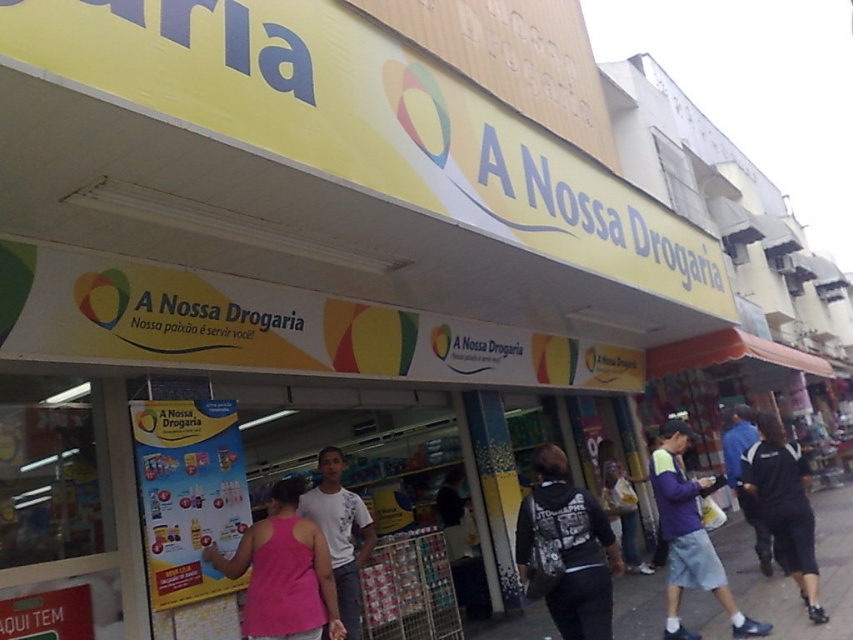
Does smooth concrete pavement at lower center lie in front of black cotton shirt at lower right?

No, smooth concrete pavement at lower center is further to the viewer.

Who is more distant from viewer, (x=787, y=616) or (x=795, y=557)?

The point (x=795, y=557) is behind.

The height and width of the screenshot is (640, 853). Describe the element at coordinates (790, 579) in the screenshot. I see `smooth concrete pavement at lower center` at that location.

Locate an element on the screen. Image resolution: width=853 pixels, height=640 pixels. smooth concrete pavement at lower center is located at coordinates (790, 579).

Locate an element on the screen. purple cotton hoodie at center is located at coordinates (689, 536).

Which is more to the left, purple cotton hoodie at center or dark blue jacket at center?

purple cotton hoodie at center is more to the left.

The image size is (853, 640). Identify the location of purple cotton hoodie at center. (689, 536).

Find the location of a particular element. This screenshot has width=853, height=640. smooth concrete pavement at lower center is located at coordinates (790, 579).

Does smooth concrete pavement at lower center appear under black backpack at center?

Yes.

Is point (730, 515) positioned before point (566, 554)?

No, it is behind (566, 554).

Locate an element on the screen. Image resolution: width=853 pixels, height=640 pixels. smooth concrete pavement at lower center is located at coordinates (790, 579).